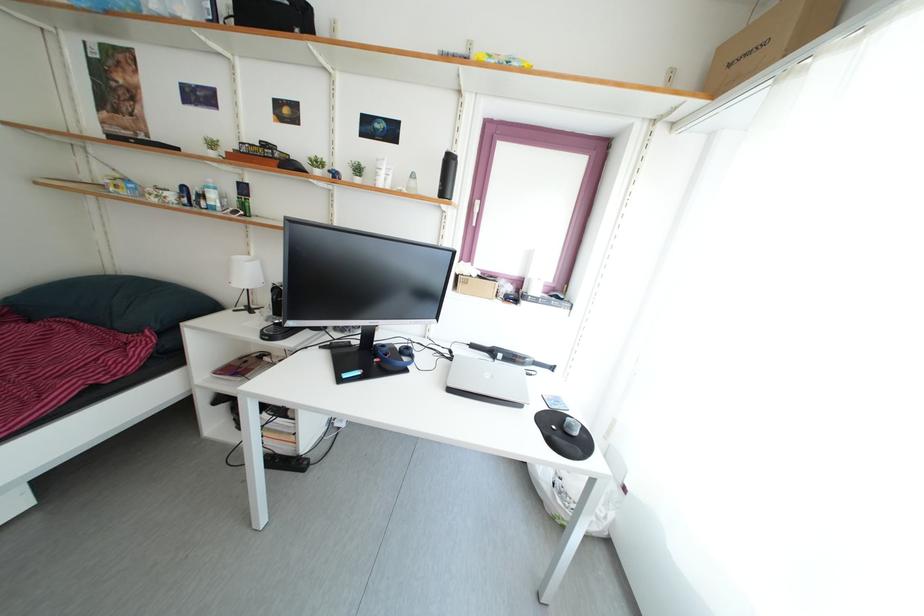
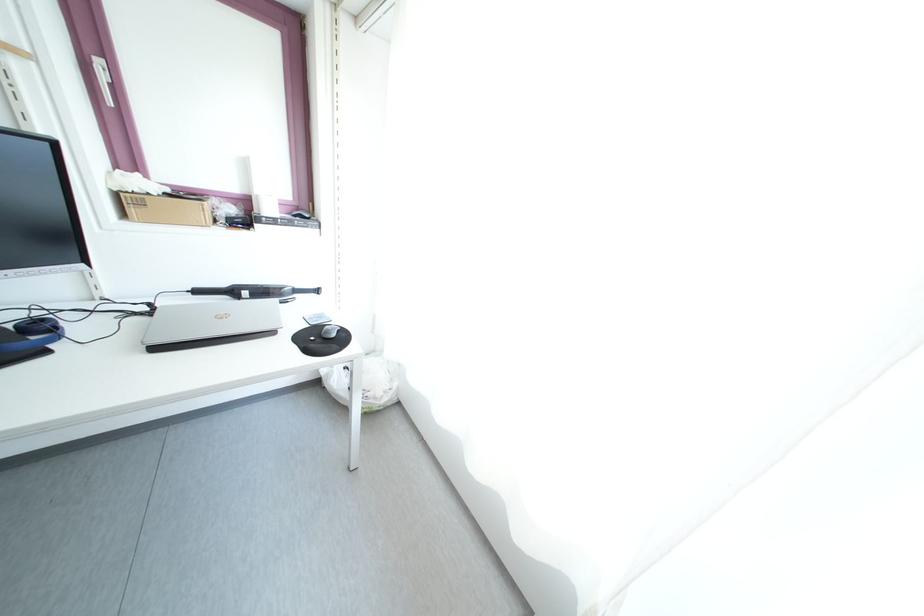
Locate, in the second image, the point that corresponds to point 506,363 in the first image.

(251, 302)